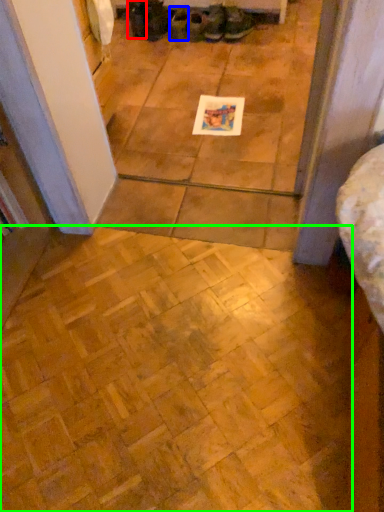
Question: Estimate the real-world distances between objects in this image. Which object is closer to footwear (highlighted by a red box), footwear (highlighted by a blue box) or ceramic tile (highlighted by a green box)?

Choices:
 (A) footwear
 (B) ceramic tile

Answer: (A)